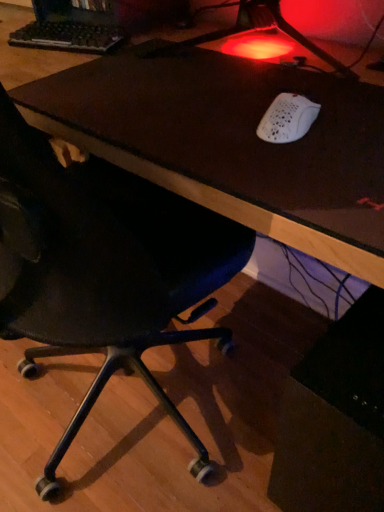
Question: From the image's perspective, is brown leather desk at center below black plastic keyboard at upper left?

Choices:
 (A) yes
 (B) no

Answer: (A)

Question: Does brown leather desk at center have a greater height compared to black plastic keyboard at upper left?

Choices:
 (A) yes
 (B) no

Answer: (A)

Question: Can you confirm if brown leather desk at center is positioned to the left of black plastic keyboard at upper left?

Choices:
 (A) yes
 (B) no

Answer: (B)

Question: Is brown leather desk at center bigger than black plastic keyboard at upper left?

Choices:
 (A) no
 (B) yes

Answer: (B)

Question: Considering the relative sizes of brown leather desk at center and black plastic keyboard at upper left in the image provided, is brown leather desk at center wider than black plastic keyboard at upper left?

Choices:
 (A) no
 (B) yes

Answer: (B)

Question: Considering the positions of white matte mouse at upper right and black mesh chair at lower left in the image, is white matte mouse at upper right bigger or smaller than black mesh chair at lower left?

Choices:
 (A) big
 (B) small

Answer: (B)

Question: From a real-world perspective, is white matte mouse at upper right positioned above or below black mesh chair at lower left?

Choices:
 (A) above
 (B) below

Answer: (A)

Question: In terms of width, does white matte mouse at upper right look wider or thinner when compared to black mesh chair at lower left?

Choices:
 (A) thin
 (B) wide

Answer: (A)

Question: Choose the correct answer: Is white matte mouse at upper right inside black mesh chair at lower left or outside it?

Choices:
 (A) inside
 (B) outside

Answer: (B)

Question: From the image's perspective, is black plastic keyboard at upper left located above or below brown leather desk at center?

Choices:
 (A) below
 (B) above

Answer: (B)

Question: Based on their positions, is black plastic keyboard at upper left located to the left or right of brown leather desk at center?

Choices:
 (A) right
 (B) left

Answer: (B)

Question: Is point (38, 9) positioned closer to the camera than point (369, 247)?

Choices:
 (A) farther
 (B) closer

Answer: (A)

Question: In terms of size, does black plastic keyboard at upper left appear bigger or smaller than brown leather desk at center?

Choices:
 (A) small
 (B) big

Answer: (A)

Question: Considering the positions of white matte mouse at upper right and black plastic keyboard at upper left in the image, is white matte mouse at upper right bigger or smaller than black plastic keyboard at upper left?

Choices:
 (A) big
 (B) small

Answer: (B)

Question: In terms of height, does white matte mouse at upper right look taller or shorter compared to black plastic keyboard at upper left?

Choices:
 (A) short
 (B) tall

Answer: (B)